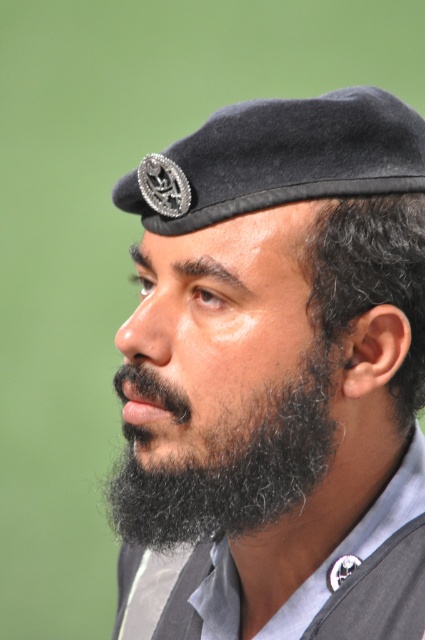
Is black felt beret at upper center bigger than black curly beard at lower left?

No, black felt beret at upper center is not bigger than black curly beard at lower left.

Does black felt beret at upper center appear on the left side of black curly beard at lower left?

No, black felt beret at upper center is not to the left of black curly beard at lower left.

Where is `black felt beret at upper center`? The height and width of the screenshot is (640, 425). black felt beret at upper center is located at coordinates (277, 157).

Who is taller, black felt beret at center or dark curly hair at ear?

Standing taller between the two is black felt beret at center.

Find the location of a particular element. black felt beret at center is located at coordinates (275, 374).

Does point (339, 454) lie behind point (337, 273)?

Yes, point (339, 454) is farther from viewer.

Locate an element on the screen. black felt beret at center is located at coordinates (275, 374).

Can you confirm if black felt beret at center is positioned below black curly beard at lower left?

No, black felt beret at center is not below black curly beard at lower left.

Identify the location of black felt beret at center. (275, 374).